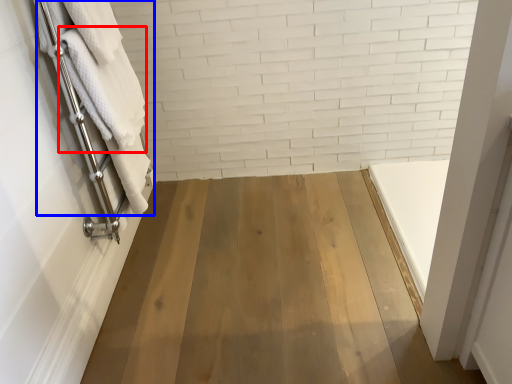
Question: Which object is closer to the camera taking this photo, bath towel (highlighted by a red box) or bath towel (highlighted by a blue box)?

Choices:
 (A) bath towel
 (B) bath towel

Answer: (B)